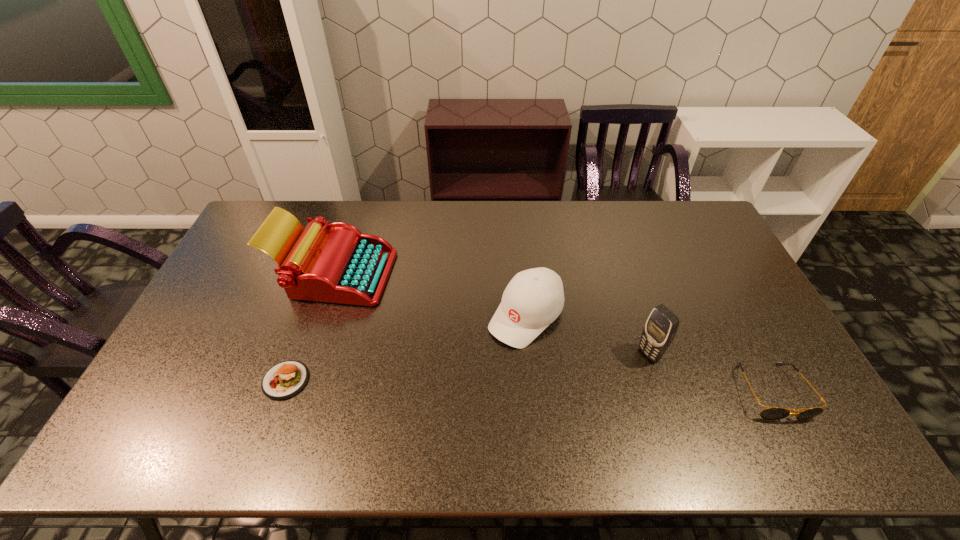
Image resolution: width=960 pixels, height=540 pixels. I want to click on free space on the desktop that is between the shortest object and the second shortest object and is positioned on the front face of the cellular telephone, so click(588, 387).

Identify the location of free space on the desktop that is between the patty (food) and the rightmost object and is positioned on the front-facing side of the third object from left to right. This screenshot has height=540, width=960. (459, 384).

What are the coordinates of `vacant space on the desktop that is between the shortest object and the sunglasses and is positioned on the typing side of the typewriter` in the screenshot? It's located at (529, 386).